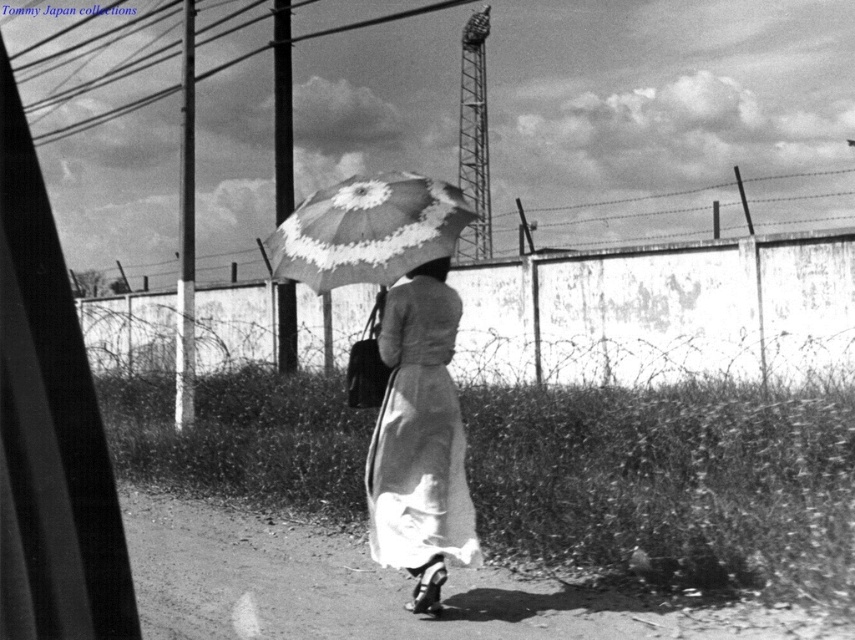
Question: Observing the image, what is the correct spatial positioning of matte gray dress at center in reference to white floral-patterned umbrella at center?

Choices:
 (A) right
 (B) left

Answer: (A)

Question: Which point is farther to the camera?

Choices:
 (A) (369, 177)
 (B) (440, 374)
 (C) (449, 262)

Answer: (A)

Question: Is white floral-patterned umbrella at center positioned at the back of smooth fabric hat at upper center?

Choices:
 (A) yes
 (B) no

Answer: (B)

Question: Can you confirm if white floral-patterned umbrella at center is bigger than smooth fabric hat at upper center?

Choices:
 (A) no
 (B) yes

Answer: (B)

Question: Which point appears closest to the camera in this image?

Choices:
 (A) (434, 516)
 (B) (416, 273)

Answer: (A)

Question: Which is farther from the smooth fabric hat at upper center?

Choices:
 (A) matte gray dress at center
 (B) white floral-patterned umbrella at center

Answer: (A)